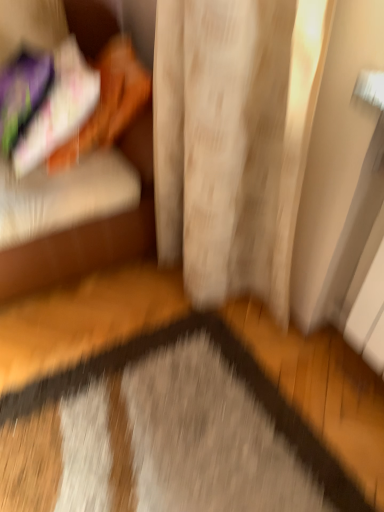
Question: Considering the relative sizes of velvet orange couch at left and gray textured mat at center in the image provided, is velvet orange couch at left smaller than gray textured mat at center?

Choices:
 (A) no
 (B) yes

Answer: (A)

Question: Is velvet orange couch at left oriented towards gray textured mat at center?

Choices:
 (A) yes
 (B) no

Answer: (A)

Question: Is velvet orange couch at left beside gray textured mat at center?

Choices:
 (A) no
 (B) yes

Answer: (A)

Question: Is velvet orange couch at left not near gray textured mat at center?

Choices:
 (A) no
 (B) yes

Answer: (A)

Question: Is velvet orange couch at left bigger than gray textured mat at center?

Choices:
 (A) no
 (B) yes

Answer: (B)

Question: From a real-world perspective, is velvet orange couch at left under gray textured mat at center?

Choices:
 (A) yes
 (B) no

Answer: (B)

Question: Can you confirm if gray textured mat at center is positioned to the right of velvet orange couch at left?

Choices:
 (A) no
 (B) yes

Answer: (B)

Question: Is the depth of gray textured mat at center greater than that of velvet orange couch at left?

Choices:
 (A) no
 (B) yes

Answer: (A)

Question: Can you confirm if gray textured mat at center is taller than velvet orange couch at left?

Choices:
 (A) no
 (B) yes

Answer: (A)

Question: Is velvet orange couch at left surrounded by gray textured mat at center?

Choices:
 (A) yes
 (B) no

Answer: (B)

Question: Does gray textured mat at center have a smaller size compared to velvet orange couch at left?

Choices:
 (A) no
 (B) yes

Answer: (B)

Question: Is gray textured mat at center placed right next to velvet orange couch at left?

Choices:
 (A) no
 (B) yes

Answer: (A)

Question: From a real-world perspective, relative to gray textured mat at center, is velvet orange couch at left vertically above or below?

Choices:
 (A) above
 (B) below

Answer: (A)